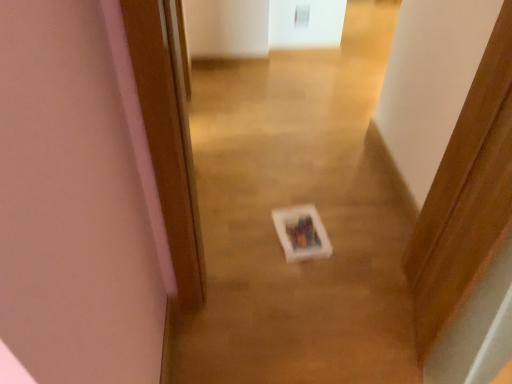
The image size is (512, 384). I want to click on white plastic box at center, so pyautogui.click(x=298, y=204).

What do you see at coordinates (298, 204) in the screenshot? I see `white plastic box at center` at bounding box center [298, 204].

Where is `white plastic box at center`? The height and width of the screenshot is (384, 512). white plastic box at center is located at coordinates click(x=298, y=204).